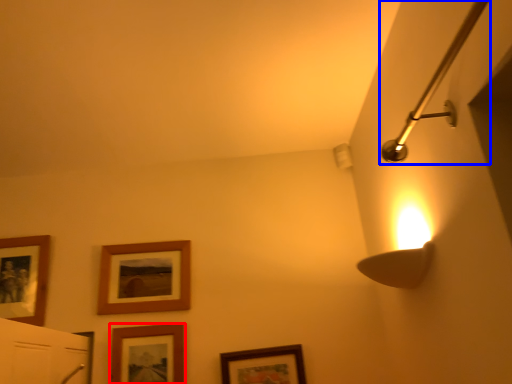
Question: Which of the following is the closest to the observer, picture frame (highlighted by a red box) or shower (highlighted by a blue box)?

Choices:
 (A) picture frame
 (B) shower

Answer: (B)